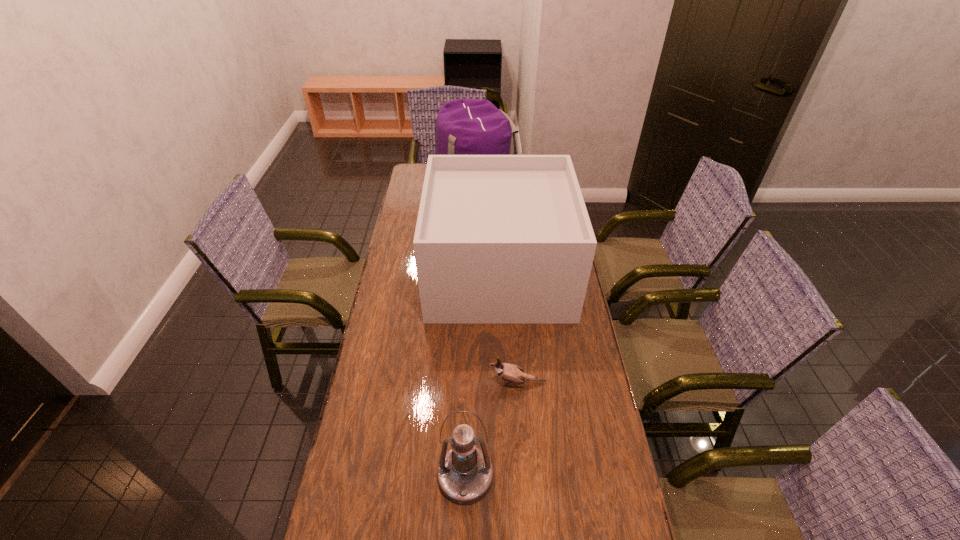
Locate an element on the screen. The width and height of the screenshot is (960, 540). free space located at the face of the third farthest object is located at coordinates (401, 382).

Locate an element on the screen. free space located 0.380m at the face of the third farthest object is located at coordinates (366, 382).

The image size is (960, 540). In order to click on vacant area situated 0.270m at the face of the third farthest object in this screenshot , I will do `click(401, 382)`.

You are a GUI agent. You are given a task and a screenshot of the screen. Output one action in this format:
    pyautogui.click(x=<x>, y=<y>)
    Task: Click on the object that is at the far edge
    This screenshot has width=960, height=540.
    Given the screenshot: What is the action you would take?
    pyautogui.click(x=466, y=126)

This screenshot has width=960, height=540. Identify the location of object present at the left edge. (466, 126).

The width and height of the screenshot is (960, 540). I want to click on object that is at the right edge, so click(500, 239).

Where is `object that is at the far left corner`? object that is at the far left corner is located at coordinates pos(466,126).

At what (x,y) coordinates should I click in order to perform the action: click on vacant space at the left edge of the desktop. Please return your answer as a coordinate pair (x, y). This screenshot has width=960, height=540. Looking at the image, I should click on (385, 508).

The width and height of the screenshot is (960, 540). Find the location of `free region at the right edge`. free region at the right edge is located at coordinates click(615, 502).

This screenshot has width=960, height=540. I want to click on blank area at the far left corner, so click(x=414, y=186).